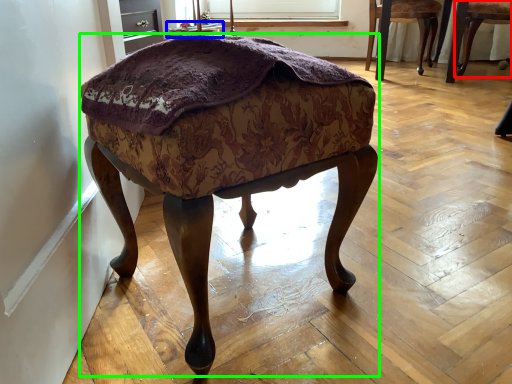
Question: Considering the real-world distances, which object is closest to chair (highlighted by a red box)? side table (highlighted by a blue box) or stool (highlighted by a green box).

Choices:
 (A) side table
 (B) stool

Answer: (A)